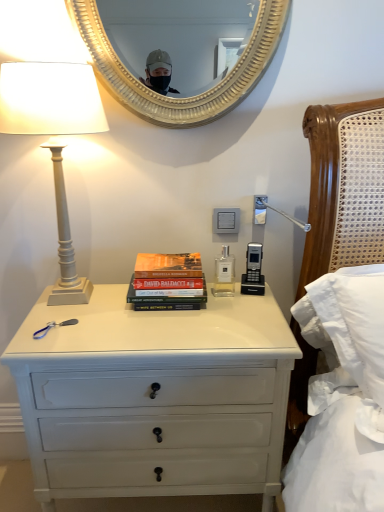
Question: Considering the relative positions of white painted wood chest of drawers at center and white plastic power outlet at center in the image provided, is white painted wood chest of drawers at center to the left or to the right of white plastic power outlet at center?

Choices:
 (A) right
 (B) left

Answer: (B)

Question: Considering the positions of white painted wood chest of drawers at center and white plastic power outlet at center in the image, is white painted wood chest of drawers at center wider or thinner than white plastic power outlet at center?

Choices:
 (A) thin
 (B) wide

Answer: (B)

Question: Which of these objects is positioned farthest from the white painted wood chest of drawers at center?

Choices:
 (A) white matte column lamp at left
 (B) white plastic power outlet at center
 (C) gold textured mirror at upper center
 (D) hardcover books at center

Answer: (C)

Question: Which object is the closest to the white painted wood chest of drawers at center?

Choices:
 (A) hardcover books at center
 (B) gold textured mirror at upper center
 (C) white plastic power outlet at center
 (D) white matte column lamp at left

Answer: (A)